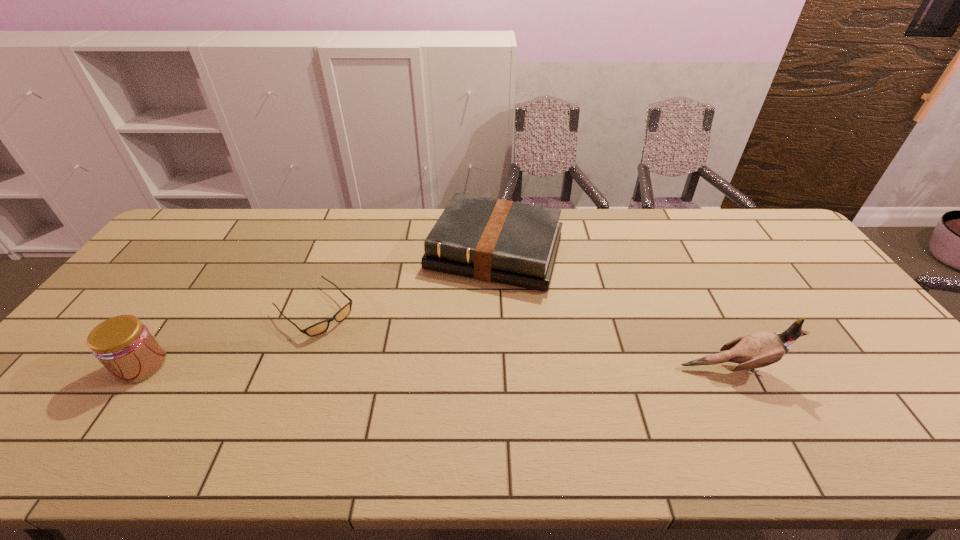
At what (x,y) coordinates should I click in order to perform the action: click on free space on the desktop that is between the third shortest object and the bird and is positioned on the front-facing side of the second object from left to right. Please return your answer as a coordinate pair (x, y). The height and width of the screenshot is (540, 960). Looking at the image, I should click on (376, 367).

Locate an element on the screen. The image size is (960, 540). free space on the desktop that is between the third shortest object and the rightmost object and is positioned on the spine side of the second shortest object is located at coordinates (449, 367).